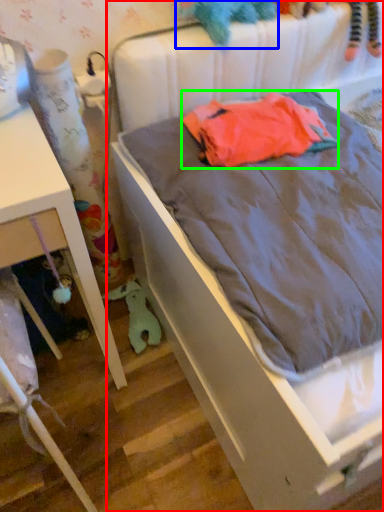
Question: Estimate the real-world distances between objects in this image. Which object is farther from bed (highlighted by a red box), toy (highlighted by a blue box) or baby clothe (highlighted by a green box)?

Choices:
 (A) toy
 (B) baby clothe

Answer: (A)